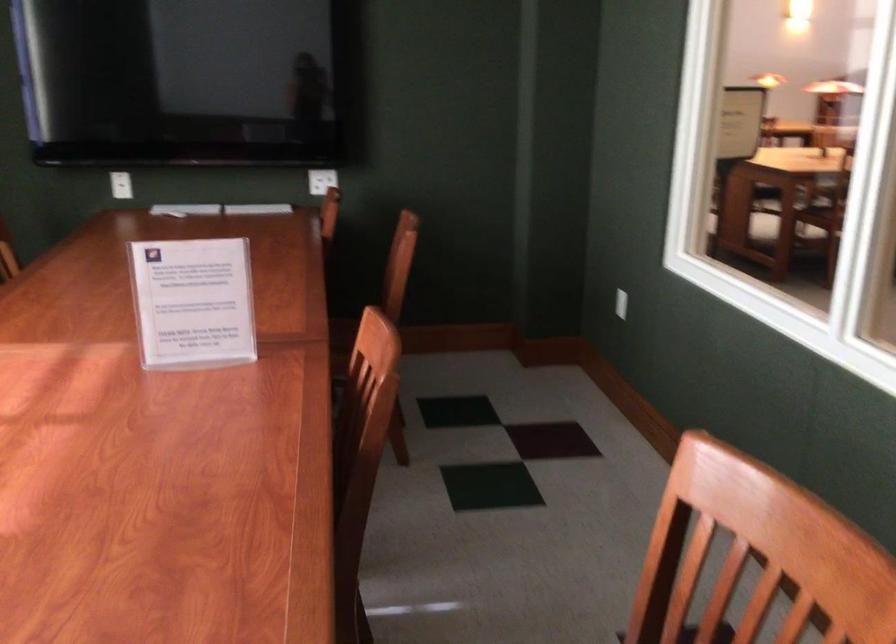
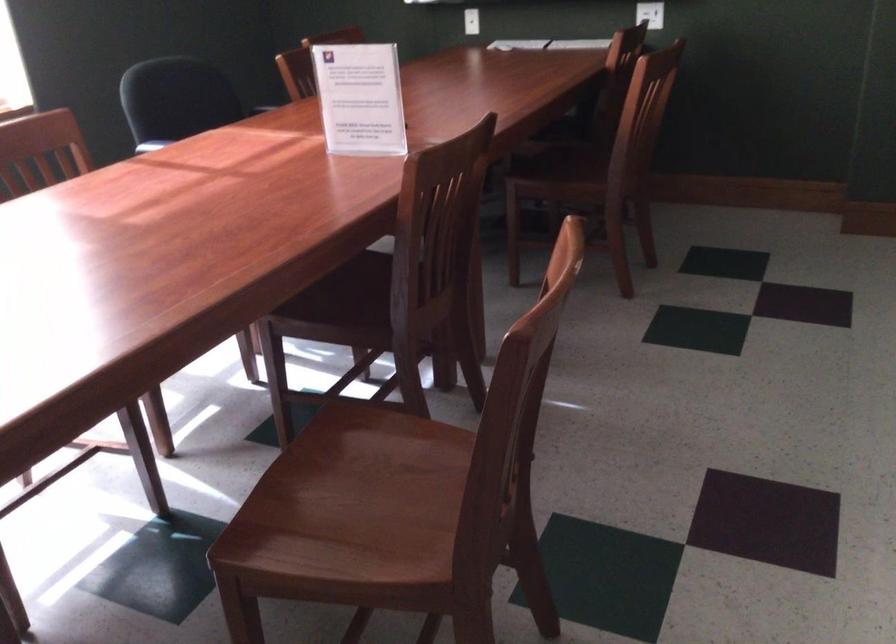
Locate, in the second image, the point that corresponds to [203,303] in the first image.

(359, 98)